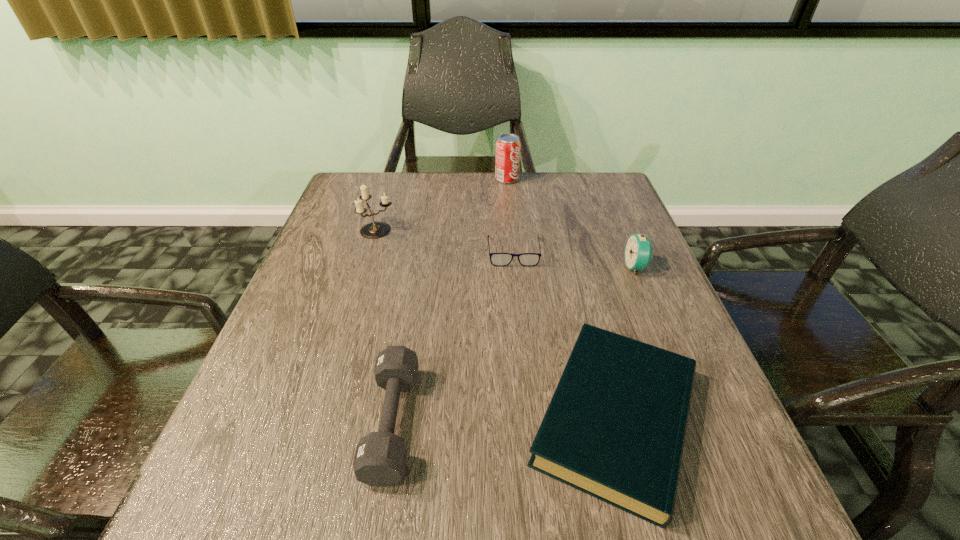
Identify the location of book at the right edge. (615, 427).

This screenshot has width=960, height=540. Find the location of `object located at the near right corner`. object located at the near right corner is located at coordinates (615, 427).

Where is `vacant area at the far edge`? The image size is (960, 540). vacant area at the far edge is located at coordinates (552, 172).

Where is `vacant space at the near edge`? vacant space at the near edge is located at coordinates (482, 528).

Where is `free space at the left edge of the desktop`? This screenshot has height=540, width=960. free space at the left edge of the desktop is located at coordinates pos(332,320).

You are a GUI agent. You are given a task and a screenshot of the screen. Output one action in this format:
    pyautogui.click(x=<x>, y=<y>)
    Task: Click on the free spot at the right edge of the desktop
    This screenshot has height=540, width=960.
    Given the screenshot: What is the action you would take?
    (x=715, y=418)

The image size is (960, 540). What are the coordinates of `vacant region at the far left corner` in the screenshot? It's located at (389, 197).

In the image, there is a desktop. Where is `vacant space at the near left corner`? vacant space at the near left corner is located at coordinates (289, 492).

At what (x,y) coordinates should I click in order to perform the action: click on vacant space at the far right corner. Please return your answer as a coordinate pair (x, y). Looking at the image, I should click on (597, 185).

Find the location of a particular element. The width and height of the screenshot is (960, 540). empty space that is in between the dumbbell and the shortest object is located at coordinates (453, 337).